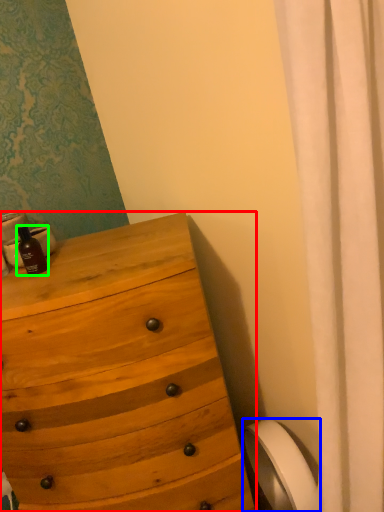
Question: Considering the real-world distances, which object is farthest from chest of drawers (highlighted by a red box)? toilet paper (highlighted by a blue box) or bottle (highlighted by a green box)?

Choices:
 (A) toilet paper
 (B) bottle

Answer: (A)